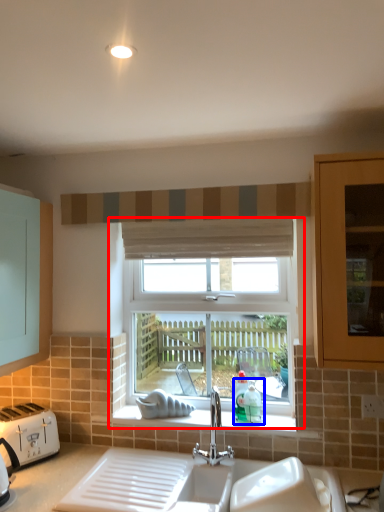
Question: Among these objects, which one is farthest to the camera, window (highlighted by a red box) or teal (highlighted by a blue box)?

Choices:
 (A) window
 (B) teal

Answer: (A)